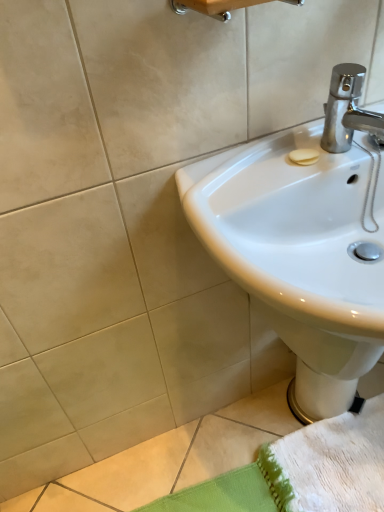
Locate an element on the screen. The image size is (384, 512). white glossy bidet at lower right is located at coordinates (321, 366).

The width and height of the screenshot is (384, 512). Describe the element at coordinates (321, 366) in the screenshot. I see `white glossy bidet at lower right` at that location.

What do you see at coordinates (305, 241) in the screenshot? The height and width of the screenshot is (512, 384). I see `white glossy sink at upper right` at bounding box center [305, 241].

You are a GUI agent. You are given a task and a screenshot of the screen. Output one action in this format:
    pyautogui.click(x=<x>, y=<y>)
    Task: Click on the white glossy bidet at lower right
    
    Given the screenshot: What is the action you would take?
    pyautogui.click(x=321, y=366)

Considering the sizes of wooden towel bar at upper center and white glossy bidet at lower right in the image, is wooden towel bar at upper center bigger or smaller than white glossy bidet at lower right?

Considering their sizes, wooden towel bar at upper center takes up less space than white glossy bidet at lower right.

From the picture: From a real-world perspective, which object rests below the other?

From a 3D spatial view, white glossy bidet at lower right is below.

Is point (286, 2) positioned behind point (359, 373)?

No.

Between wooden towel bar at upper center and white glossy bidet at lower right, which one appears on the left side from the viewer's perspective?

wooden towel bar at upper center.

In terms of width, does wooden towel bar at upper center look wider or thinner when compared to white glossy sink at upper right?

wooden towel bar at upper center is thinner than white glossy sink at upper right.

Who is taller, wooden towel bar at upper center or white glossy sink at upper right?

white glossy sink at upper right.

Does wooden towel bar at upper center appear on the right side of white glossy sink at upper right?

Incorrect, wooden towel bar at upper center is not on the right side of white glossy sink at upper right.

Looking at their sizes, would you say white glossy bidet at lower right is wider or thinner than wooden towel bar at upper center?

In the image, white glossy bidet at lower right appears to be wider than wooden towel bar at upper center.

Is there a large distance between white glossy bidet at lower right and wooden towel bar at upper center?

white glossy bidet at lower right is near wooden towel bar at upper center, not far away.

The height and width of the screenshot is (512, 384). In the image, there is a wooden towel bar at upper center. What are the coordinates of `bidet below it (from the image's perspective)` in the screenshot? It's located at (321, 366).

Where is `towel bar behind the white glossy sink at upper right`? This screenshot has height=512, width=384. towel bar behind the white glossy sink at upper right is located at coordinates (213, 7).

Is there a large distance between white glossy sink at upper right and wooden towel bar at upper center?

No.

Which is in front, point (350, 78) or point (218, 7)?

The point (218, 7) is more forward.

Consider the image. Is white glossy bidet at lower right further to the viewer compared to white glossy sink at upper right?

Yes, it is behind white glossy sink at upper right.

Is white glossy bidet at lower right far from white glossy sink at upper right?

No, there isn't a large distance between white glossy bidet at lower right and white glossy sink at upper right.

Is white glossy bidet at lower right not within white glossy sink at upper right?

white glossy bidet at lower right lies outside white glossy sink at upper right's area.

From the image's perspective, which object appears higher, white glossy bidet at lower right or white glossy sink at upper right?

white glossy sink at upper right is shown above in the image.

How distant is white glossy sink at upper right from white glossy bidet at lower right?

white glossy sink at upper right and white glossy bidet at lower right are 20.46 centimeters apart.

Is white glossy bidet at lower right a part of white glossy sink at upper right?

No, white glossy sink at upper right does not contain white glossy bidet at lower right.

Between white glossy sink at upper right and white glossy bidet at lower right, which one has larger size?

With larger size is white glossy sink at upper right.

Are white glossy sink at upper right and white glossy bidet at lower right located far from each other?

No, white glossy sink at upper right is not far away from white glossy bidet at lower right.

Identify the location of towel bar above the white glossy bidet at lower right (from a real-world perspective). point(213,7).

The width and height of the screenshot is (384, 512). What are the coordinates of `towel bar on the left of white glossy sink at upper right` in the screenshot? It's located at (213, 7).

Looking at the image, which one is located closer to wooden towel bar at upper center, white glossy sink at upper right or white glossy bidet at lower right?

white glossy sink at upper right is closer to wooden towel bar at upper center.

When comparing their distances from white glossy sink at upper right, does wooden towel bar at upper center or white glossy bidet at lower right seem further?

The object further to white glossy sink at upper right is wooden towel bar at upper center.

Estimate the real-world distances between objects in this image. Which object is further from white glossy bidet at lower right, white glossy sink at upper right or wooden towel bar at upper center?

wooden towel bar at upper center.

From the picture: From the image, which object appears to be farther from wooden towel bar at upper center, white glossy bidet at lower right or white glossy sink at upper right?

white glossy bidet at lower right is further to wooden towel bar at upper center.

From the image, which object appears to be farther from white glossy sink at upper right, white glossy bidet at lower right or wooden towel bar at upper center?

wooden towel bar at upper center is further to white glossy sink at upper right.

When comparing their distances from white glossy bidet at lower right, does wooden towel bar at upper center or white glossy sink at upper right seem further?

Among the two, wooden towel bar at upper center is located further to white glossy bidet at lower right.

The image size is (384, 512). What are the coordinates of `towel bar located between white glossy sink at upper right and white glossy bidet at lower right in the depth direction` in the screenshot? It's located at (213, 7).